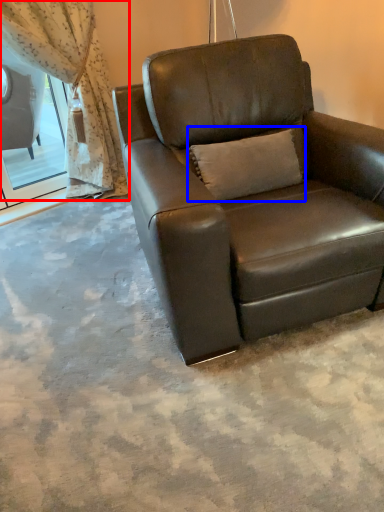
Question: Among these objects, which one is nearest to the camera, curtain (highlighted by a red box) or pillow (highlighted by a blue box)?

Choices:
 (A) curtain
 (B) pillow

Answer: (B)